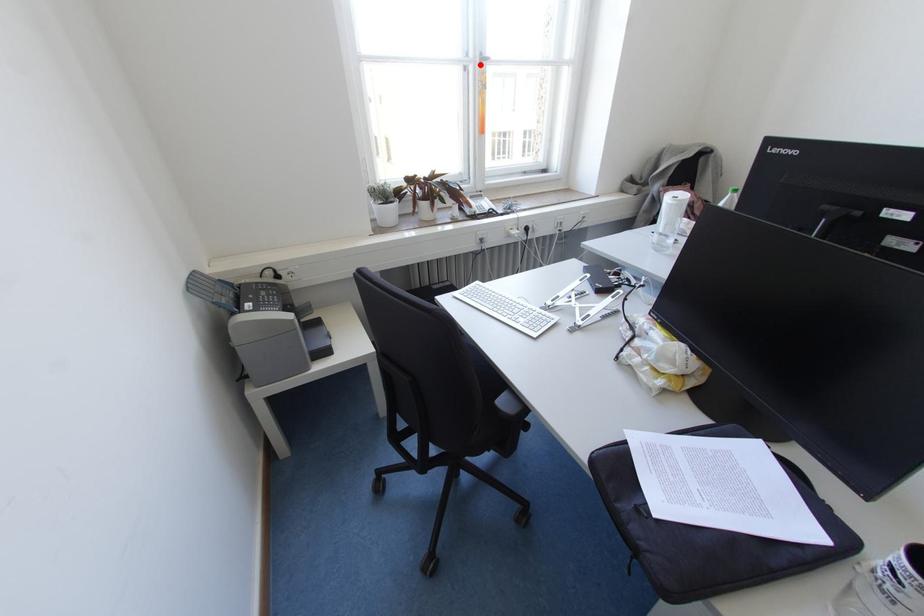
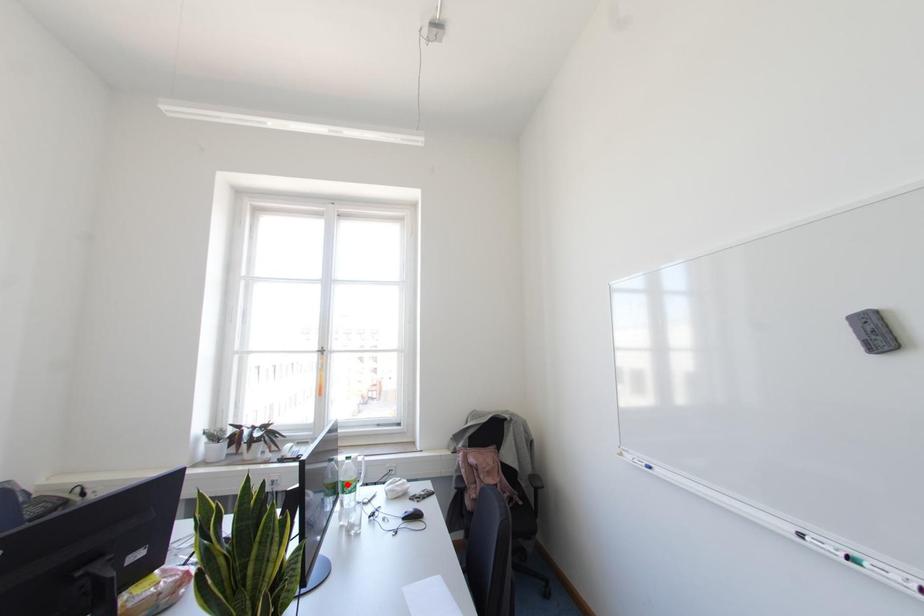
I am providing you with two images of the same scene from different viewpoints. A red point is marked on the first image and another point is marked on the second image. Is the red point in image1 aligned with the point shown in image2?

No